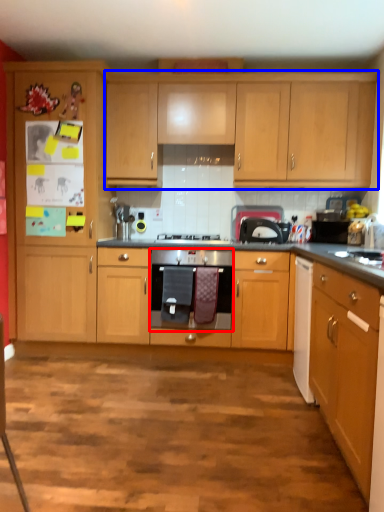
Question: Which object appears closest to the camera in this image, kitchen appliance (highlighted by a red box) or cabinetry (highlighted by a blue box)?

Choices:
 (A) kitchen appliance
 (B) cabinetry

Answer: (A)